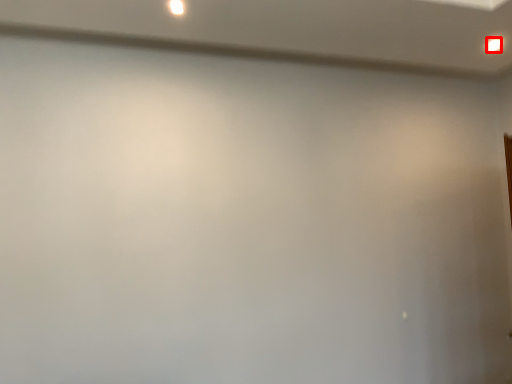
Question: From the image's perspective, what is the correct spatial relationship of light (annotated by the red box) in relation to light?

Choices:
 (A) above
 (B) below

Answer: (B)